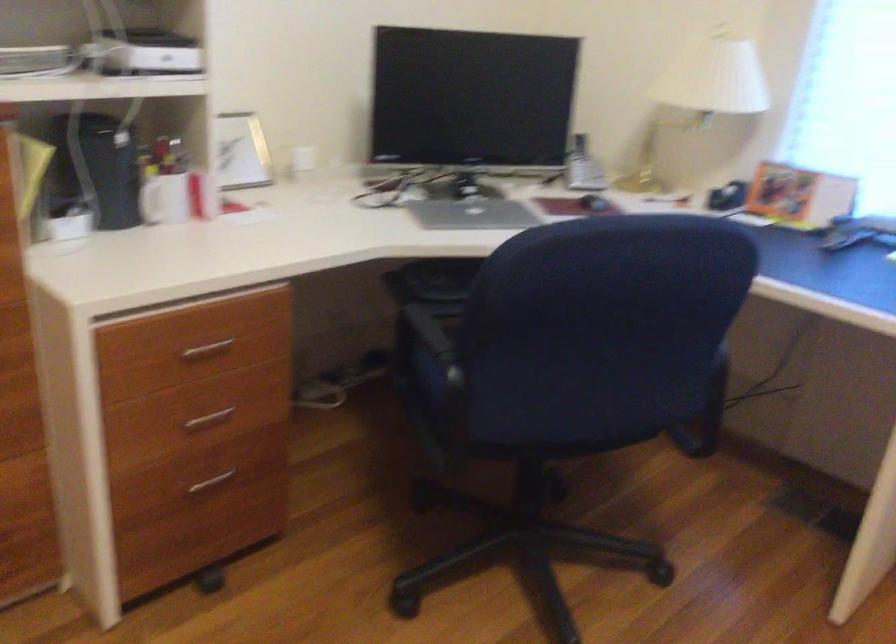
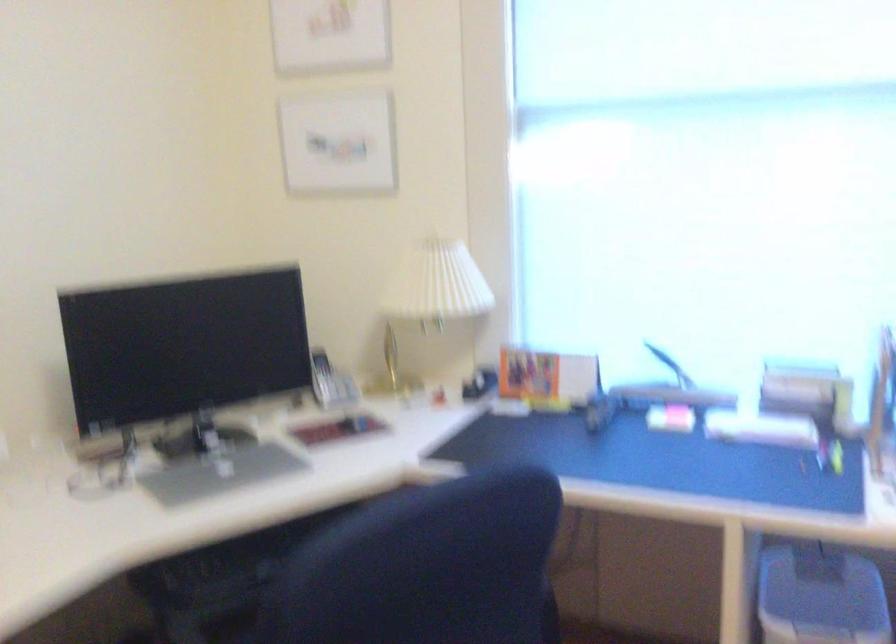
Question: In a continuous first-person perspective shot, in which direction is the camera moving?

Choices:
 (A) Left
 (B) Right
 (C) Forward
 (D) Backward

Answer: (C)